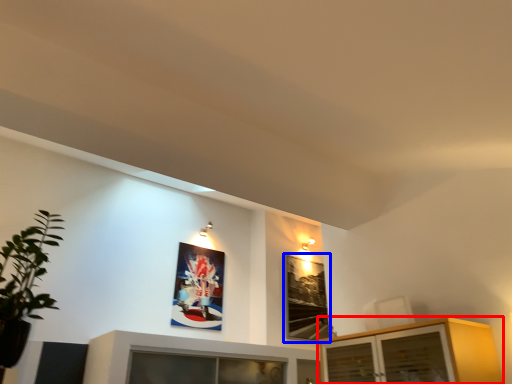
Question: Which object is further to the camera taking this photo, cabinetry (highlighted by a red box) or picture frame (highlighted by a blue box)?

Choices:
 (A) cabinetry
 (B) picture frame

Answer: (B)